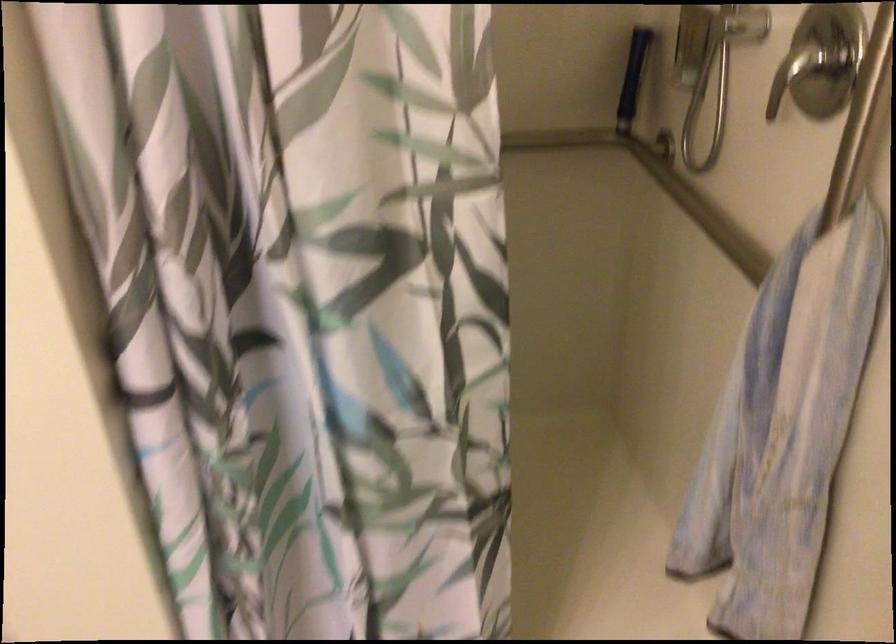
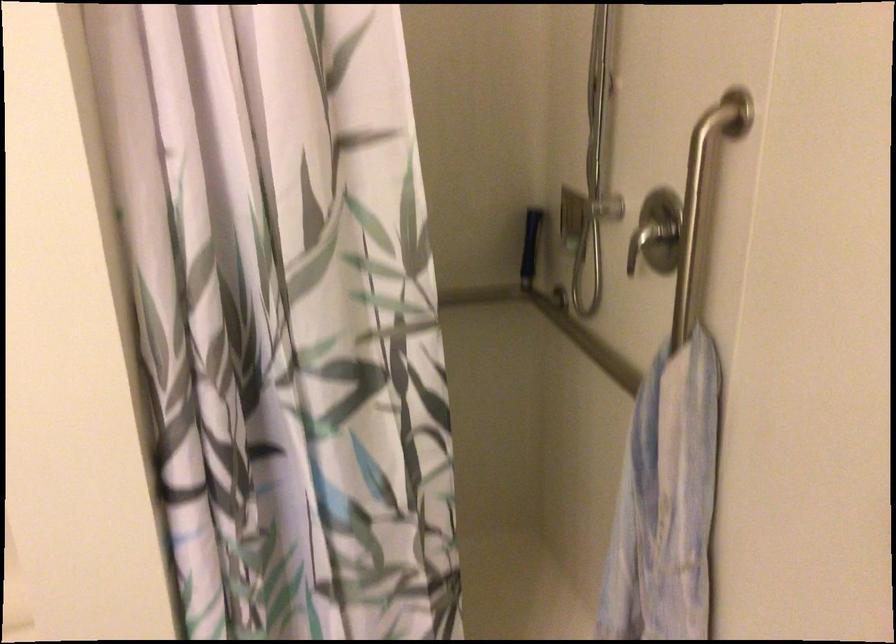
Question: How did the camera likely rotate?

Choices:
 (A) Left
 (B) Right
 (C) Up
 (D) Down

Answer: (C)